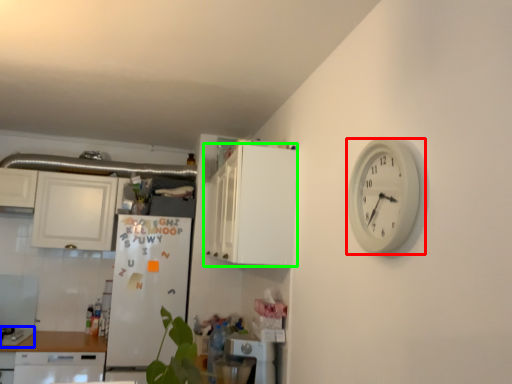
Question: Based on their relative distances, which object is nearer to wall clock (highlighted by a red box)? Choose from gas stove (highlighted by a blue box) and cabinetry (highlighted by a green box).

Choices:
 (A) gas stove
 (B) cabinetry

Answer: (B)